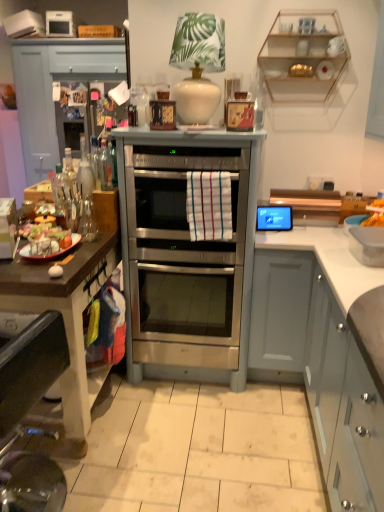
Question: Is point (72, 68) positioned closer to the camera than point (357, 386)?

Choices:
 (A) farther
 (B) closer

Answer: (A)

Question: From a real-world perspective, is brushed metal drawer at upper left positioned above or below white matte cabinet at right, the 3th cabinetry when ordered from back to front?

Choices:
 (A) below
 (B) above

Answer: (B)

Question: Considering the real-world distances, which object is farthest from the matte blue cabinet at left, which appears as the 1th cabinetry when viewed from the back?

Choices:
 (A) white matte cabinet at right, arranged as the third cabinetry when viewed from the left
 (B) brushed metal drawer at upper left
 (C) clear glass bottle at left, acting as the 2th bottle starting from the right
 (D) clear glass bottle at left, the 2th bottle positioned from the left
 (E) yellow crispy chips at right, placed as the 2th food when sorted from left to right

Answer: (E)

Question: Which of these objects is positioned closest to the clear glass bottle at left, the 2th bottle positioned from the left?

Choices:
 (A) matte black tablet at upper right
 (B) white matte cabinet at right, which is the 3th cabinetry in top-to-bottom order
 (C) clear glass shelves at upper right
 (D) brushed metal drawer at upper left
 (E) clear glass bottle at left, arranged as the first bottle when viewed from the left

Answer: (E)